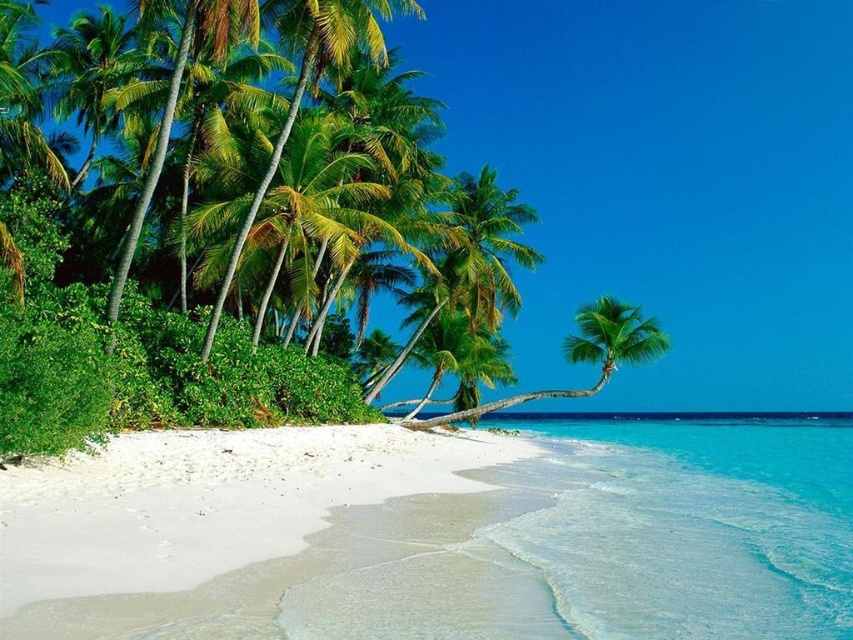
Question: Which point is closer to the camera?

Choices:
 (A) green leafy palm tree at center
 (B) white sandy beach at lower left

Answer: (B)

Question: Considering the relative positions of white sandy beach at lower left and green leafy palm tree at center in the image provided, where is white sandy beach at lower left located with respect to green leafy palm tree at center?

Choices:
 (A) right
 (B) left

Answer: (B)

Question: Which of the following is the farthest from the observer?

Choices:
 (A) (88, 476)
 (B) (595, 384)

Answer: (B)

Question: Is white sandy beach at lower left to the right of green leafy palm tree at center from the viewer's perspective?

Choices:
 (A) no
 (B) yes

Answer: (A)

Question: Is white sandy beach at lower left behind green leafy palm tree at center?

Choices:
 (A) no
 (B) yes

Answer: (A)